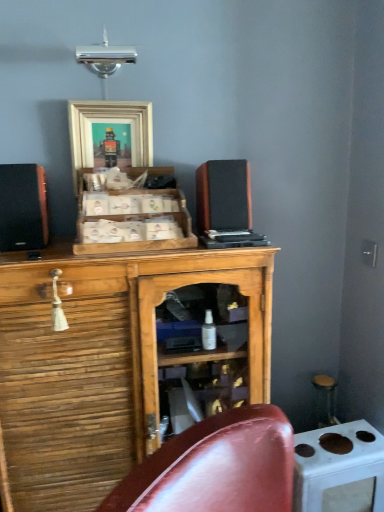
Measure the distance between wooden bar stool at right and camera.

They are 1.75 meters apart.

What are the coordinates of `wooden framed picture at upper center` in the screenshot? It's located at (105, 130).

Where is `wooden cabinet at center, placed as the 2th cabinetry when sorted from top to bottom`? The height and width of the screenshot is (512, 384). wooden cabinet at center, placed as the 2th cabinetry when sorted from top to bottom is located at coordinates (101, 364).

The width and height of the screenshot is (384, 512). What do you see at coordinates (23, 207) in the screenshot?
I see `matte black speaker at left, positioned as the first speaker in left-to-right order` at bounding box center [23, 207].

This screenshot has height=512, width=384. I want to click on wooden speaker at center, which appears as the 1th speaker when viewed from the right, so click(x=223, y=195).

Image resolution: width=384 pixels, height=512 pixels. What do you see at coordinates (339, 469) in the screenshot?
I see `white glossy stove at lower right` at bounding box center [339, 469].

This screenshot has height=512, width=384. What are the coordinates of `white glossy stove at lower right` in the screenshot? It's located at (339, 469).

The image size is (384, 512). Find the location of `wooden bar stool at right`. wooden bar stool at right is located at coordinates (325, 400).

Considering the points (326, 405) and (7, 213), which point is behind, point (326, 405) or point (7, 213)?

Point (326, 405)

Are wooden bar stool at right and matte black speaker at left, positioned as the first speaker in left-to-right order, making contact?

No, wooden bar stool at right is not in contact with matte black speaker at left, positioned as the first speaker in left-to-right order.

Is wooden bar stool at right facing towards matte black speaker at left, positioned as the first speaker in left-to-right order?

No, wooden bar stool at right is not oriented towards matte black speaker at left, positioned as the first speaker in left-to-right order.

Which of these two, wooden bar stool at right or matte black speaker at left, positioned as the first speaker in left-to-right order, is bigger?

matte black speaker at left, positioned as the first speaker in left-to-right order.

Where is `picture frame that is above the wooden crate at center, which appears as the first cabinetry when viewed from the top (from the image's perspective)`? This screenshot has width=384, height=512. picture frame that is above the wooden crate at center, which appears as the first cabinetry when viewed from the top (from the image's perspective) is located at coordinates (105, 130).

Considering the relative sizes of wooden framed picture at upper center and wooden crate at center, which appears as the first cabinetry when viewed from the top, in the image provided, is wooden framed picture at upper center thinner than wooden crate at center, which appears as the first cabinetry when viewed from the top,?

Yes.

Between wooden framed picture at upper center and wooden crate at center, which appears as the first cabinetry when viewed from the top, which one appears on the right side from the viewer's perspective?

From the viewer's perspective, wooden crate at center, which appears as the first cabinetry when viewed from the top, appears more on the right side.

Which of these two, wooden speaker at center, which appears as the 1th speaker when viewed from the right, or matte black speaker at left, positioned as the first speaker in left-to-right order, is wider?

Wider between the two is matte black speaker at left, positioned as the first speaker in left-to-right order.

How different are the orientations of wooden speaker at center, the 2th speaker viewed from the left, and matte black speaker at left, positioned as the first speaker in left-to-right order, in degrees?

The angular difference between wooden speaker at center, the 2th speaker viewed from the left, and matte black speaker at left, positioned as the first speaker in left-to-right order, is 4.19 degrees.

Does wooden speaker at center, which appears as the 1th speaker when viewed from the right, have a greater height compared to matte black speaker at left, which ranks as the second speaker in right-to-left order?

In fact, wooden speaker at center, which appears as the 1th speaker when viewed from the right, may be shorter than matte black speaker at left, which ranks as the second speaker in right-to-left order.

Is wooden speaker at center, which appears as the 1th speaker when viewed from the right, inside the boundaries of matte black speaker at left, which ranks as the second speaker in right-to-left order, or outside?

wooden speaker at center, which appears as the 1th speaker when viewed from the right, lies outside matte black speaker at left, which ranks as the second speaker in right-to-left order.

The width and height of the screenshot is (384, 512). I want to click on the 1st speaker located beneath the wooden framed picture at upper center (from a real-world perspective), so click(223, 195).

Considering the relative sizes of wooden framed picture at upper center and wooden speaker at center, which appears as the 1th speaker when viewed from the right, in the image provided, is wooden framed picture at upper center taller than wooden speaker at center, which appears as the 1th speaker when viewed from the right,?

Yes, wooden framed picture at upper center is taller than wooden speaker at center, which appears as the 1th speaker when viewed from the right.

Is wooden framed picture at upper center far away from wooden speaker at center, the 2th speaker viewed from the left?

No, wooden framed picture at upper center is not far away from wooden speaker at center, the 2th speaker viewed from the left.

Is point (135, 157) farther from viewer compared to point (224, 204)?

Yes, point (135, 157) is behind point (224, 204).

Who is shorter, white glossy stove at lower right or wooden speaker at center, the 2th speaker viewed from the left?

With less height is wooden speaker at center, the 2th speaker viewed from the left.

Is white glossy stove at lower right bigger or smaller than wooden speaker at center, the 2th speaker viewed from the left?

Considering their sizes, white glossy stove at lower right takes up more space than wooden speaker at center, the 2th speaker viewed from the left.

Is white glossy stove at lower right in contact with wooden speaker at center, the 2th speaker viewed from the left?

No, white glossy stove at lower right is not next to wooden speaker at center, the 2th speaker viewed from the left.

Can wooden crate at center, which appears as the first cabinetry when viewed from the top, be found inside white glossy stove at lower right?

Definitely not — wooden crate at center, which appears as the first cabinetry when viewed from the top, is not inside white glossy stove at lower right.

From a real-world perspective, is white glossy stove at lower right above or below wooden crate at center, which appears as the first cabinetry when viewed from the top?

From a real-world perspective, white glossy stove at lower right is physically below wooden crate at center, which appears as the first cabinetry when viewed from the top.

Between white glossy stove at lower right and wooden crate at center, which is counted as the second cabinetry, starting from the bottom, which one has smaller width?

Thinner between the two is white glossy stove at lower right.

Between white glossy stove at lower right and wooden crate at center, which appears as the first cabinetry when viewed from the top, which one has less height?

wooden crate at center, which appears as the first cabinetry when viewed from the top, is shorter.

Considering the positions of points (118, 250) and (216, 164), is point (118, 250) farther from camera compared to point (216, 164)?

No.

From the picture: Considering the relative positions of wooden crate at center, which is counted as the second cabinetry, starting from the bottom, and wooden speaker at center, the 2th speaker viewed from the left, in the image provided, is wooden crate at center, which is counted as the second cabinetry, starting from the bottom, behind wooden speaker at center, the 2th speaker viewed from the left,?

No, the depth of wooden crate at center, which is counted as the second cabinetry, starting from the bottom, is less than that of wooden speaker at center, the 2th speaker viewed from the left.

The width and height of the screenshot is (384, 512). I want to click on speaker that appears on the right of wooden crate at center, which is counted as the second cabinetry, starting from the bottom, so click(x=223, y=195).

From a real-world perspective, count 1st speakers upward from the wooden bar stool at right and point to it. Please provide its 2D coordinates.

[(23, 207)]

I want to click on the 1st cabinetry in front of the wooden framed picture at upper center, starting your count from the anchor, so click(x=140, y=220).

Consider the image. When comparing their distances from white glossy stove at lower right, does wooden speaker at center, the 2th speaker viewed from the left, or wooden crate at center, which appears as the first cabinetry when viewed from the top, seem further?

wooden crate at center, which appears as the first cabinetry when viewed from the top.

From the image, which object appears to be farther from wooden framed picture at upper center, wooden speaker at center, which appears as the 1th speaker when viewed from the right, or wooden crate at center, which is counted as the second cabinetry, starting from the bottom?

Among the two, wooden speaker at center, which appears as the 1th speaker when viewed from the right, is located further to wooden framed picture at upper center.

Based on their spatial positions, is wooden bar stool at right or wooden cabinet at center, the first cabinetry positioned from the bottom, closer to wooden framed picture at upper center?

Among the two, wooden cabinet at center, the first cabinetry positioned from the bottom, is located nearer to wooden framed picture at upper center.

When comparing their distances from wooden speaker at center, which appears as the 1th speaker when viewed from the right, does wooden crate at center, which is counted as the second cabinetry, starting from the bottom, or white glossy stove at lower right seem closer?

wooden crate at center, which is counted as the second cabinetry, starting from the bottom, is closer to wooden speaker at center, which appears as the 1th speaker when viewed from the right.

Looking at the image, which one is located closer to wooden speaker at center, which appears as the 1th speaker when viewed from the right, wooden cabinet at center, placed as the 2th cabinetry when sorted from top to bottom, or white glossy stove at lower right?

wooden cabinet at center, placed as the 2th cabinetry when sorted from top to bottom, is closer to wooden speaker at center, which appears as the 1th speaker when viewed from the right.

Looking at the image, which one is located further to wooden crate at center, which is counted as the second cabinetry, starting from the bottom, wooden framed picture at upper center or wooden cabinet at center, placed as the 2th cabinetry when sorted from top to bottom?

wooden cabinet at center, placed as the 2th cabinetry when sorted from top to bottom, is positioned further to the anchor wooden crate at center, which is counted as the second cabinetry, starting from the bottom.

When comparing their distances from matte black speaker at left, positioned as the first speaker in left-to-right order, does wooden speaker at center, the 2th speaker viewed from the left, or wooden cabinet at center, the first cabinetry positioned from the bottom, seem closer?

The object closer to matte black speaker at left, positioned as the first speaker in left-to-right order, is wooden cabinet at center, the first cabinetry positioned from the bottom.

Looking at the image, which one is located closer to wooden speaker at center, the 2th speaker viewed from the left, wooden crate at center, which is counted as the second cabinetry, starting from the bottom, or wooden cabinet at center, the first cabinetry positioned from the bottom?

wooden crate at center, which is counted as the second cabinetry, starting from the bottom.

I want to click on cabinetry between wooden crate at center, which appears as the first cabinetry when viewed from the top, and white glossy stove at lower right from top to bottom, so click(x=101, y=364).

At what (x,y) coordinates should I click in order to perform the action: click on appliance located between wooden cabinet at center, the first cabinetry positioned from the bottom, and wooden bar stool at right in the left-right direction. Please return your answer as a coordinate pair (x, y). This screenshot has height=512, width=384. Looking at the image, I should click on (339, 469).

Locate an element on the screen. The image size is (384, 512). speaker that lies between wooden speaker at center, which appears as the 1th speaker when viewed from the right, and white glossy stove at lower right from top to bottom is located at coordinates (23, 207).

Identify the location of speaker between wooden speaker at center, which appears as the 1th speaker when viewed from the right, and wooden cabinet at center, the first cabinetry positioned from the bottom, vertically. This screenshot has height=512, width=384. (23, 207).